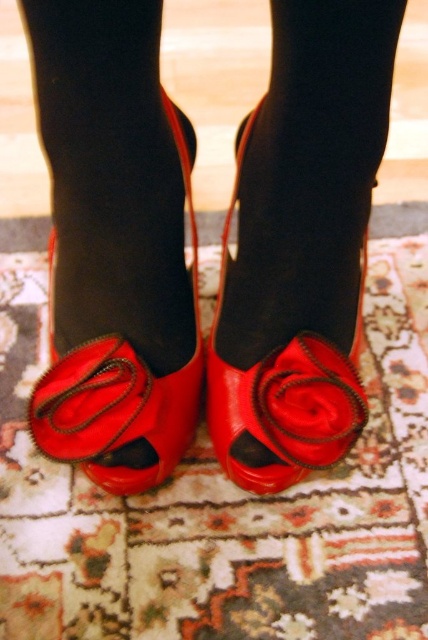
Is point (97, 35) closer to camera compared to point (294, 346)?

Yes, it is in front of point (294, 346).

Measure the distance between point (113, 284) and camera.

The distance of point (113, 284) from camera is 36.54 inches.

Identify the location of shiny patent leather shoes at center. (113, 244).

Which of these two, shiny patent leather sandal at center or shiny leather sandal at center, stands taller?

shiny leather sandal at center

You are a GUI agent. You are given a task and a screenshot of the screen. Output one action in this format:
    pyautogui.click(x=<x>, y=<y>)
    Task: Click on the shiny patent leather sandal at center
    The image size is (428, 640).
    Given the screenshot: What is the action you would take?
    pyautogui.click(x=118, y=388)

Does point (216, 413) lie in front of point (357, 394)?

No, it is not.

Is point (171, 442) closer to viewer compared to point (318, 380)?

No.

This screenshot has height=640, width=428. I want to click on shiny patent leather shoes at center, so click(x=113, y=244).